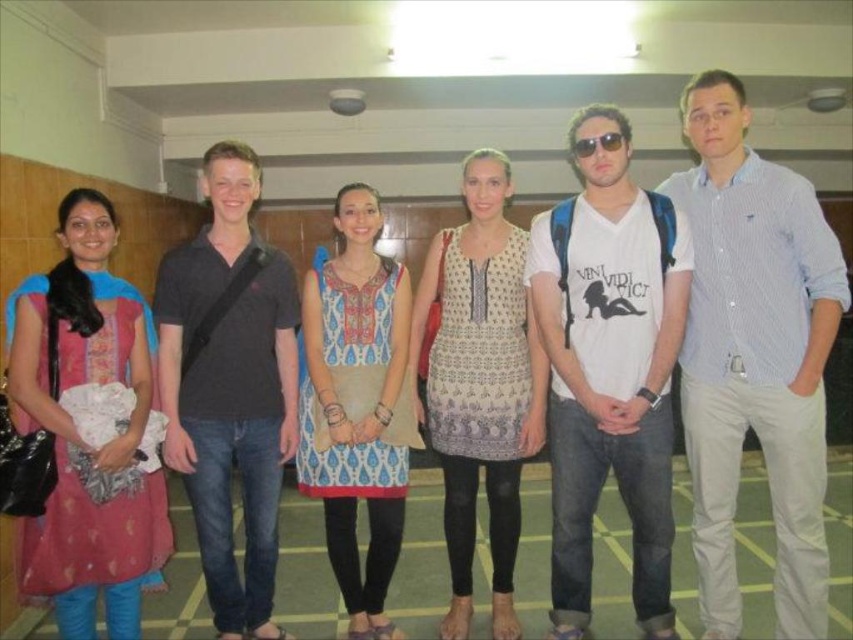
Question: Which point appears farthest from the camera in this image?

Choices:
 (A) (227, 612)
 (B) (579, 156)

Answer: (A)

Question: Which is nearer to the white cotton t-shirt at center?

Choices:
 (A) blue striped shirt at center
 (B) dark gray cotton polo shirt at center
 (C) printed cotton dress at center
 (D) matte pink dress at left

Answer: (A)

Question: Among these objects, which one is nearest to the camera?

Choices:
 (A) sunglasses at center
 (B) blue striped shirt at center
 (C) white cotton t-shirt at center
 (D) printed cotton dress at center

Answer: (B)

Question: Does white cotton t-shirt at center lie in front of patterned fabric dress at center?

Choices:
 (A) no
 (B) yes

Answer: (B)

Question: Can you confirm if white cotton t-shirt at center is thinner than dark gray cotton polo shirt at center?

Choices:
 (A) no
 (B) yes

Answer: (A)

Question: Observing the image, what is the correct spatial positioning of patterned fabric dress at center in reference to printed cotton dress at center?

Choices:
 (A) below
 (B) above

Answer: (B)